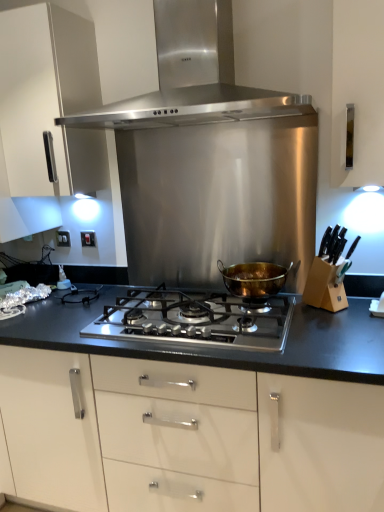
What is the approximate height of stainless steel range hood at upper center, marked as the 2th kitchen appliance in a bottom-to-top arrangement?

stainless steel range hood at upper center, marked as the 2th kitchen appliance in a bottom-to-top arrangement, is 22.13 inches tall.

The height and width of the screenshot is (512, 384). In order to click on white glossy cabinet at upper left in this screenshot , I will do `click(56, 135)`.

Describe the element at coordinates (253, 279) in the screenshot. I see `gold metallic pot at center, the second kitchen appliance positioned from the top` at that location.

I want to click on stainless steel gas stove at center, so click(x=195, y=319).

Which is behind, point (198, 118) or point (34, 65)?

The point (198, 118) is more distant.

From a real-world perspective, is stainless steel range hood at upper center, marked as the 2th kitchen appliance in a bottom-to-top arrangement, above or below white glossy cabinet at upper left?

Clearly, from a real-world perspective, stainless steel range hood at upper center, marked as the 2th kitchen appliance in a bottom-to-top arrangement, is above white glossy cabinet at upper left.

Consider the image. Is stainless steel range hood at upper center, marked as the 2th kitchen appliance in a bottom-to-top arrangement, oriented towards white glossy cabinet at upper left?

No, stainless steel range hood at upper center, marked as the 2th kitchen appliance in a bottom-to-top arrangement, is not turned towards white glossy cabinet at upper left.

Considering the relative sizes of stainless steel range hood at upper center, which is counted as the 1th kitchen appliance, starting from the top, and white glossy cabinet at upper left in the image provided, is stainless steel range hood at upper center, which is counted as the 1th kitchen appliance, starting from the top, wider than white glossy cabinet at upper left?

Correct, the width of stainless steel range hood at upper center, which is counted as the 1th kitchen appliance, starting from the top, exceeds that of white glossy cabinet at upper left.

The height and width of the screenshot is (512, 384). What are the coordinates of `the 2nd kitchen appliance to the right when counting from the white plastic electric outlet at left, the first electric outlet from the front` in the screenshot? It's located at (253, 279).

Considering the sizes of objects white plastic electric outlet at left, arranged as the second electric outlet when viewed from the left, and gold metallic pot at center, the first kitchen appliance when ordered from bottom to top, in the image provided, who is bigger, white plastic electric outlet at left, arranged as the second electric outlet when viewed from the left, or gold metallic pot at center, the first kitchen appliance when ordered from bottom to top,?

With larger size is gold metallic pot at center, the first kitchen appliance when ordered from bottom to top.

Could you measure the distance between white plastic electric outlet at left, arranged as the second electric outlet when viewed from the left, and gold metallic pot at center, the first kitchen appliance when ordered from bottom to top?

They are 33.06 inches apart.

Which is more to the left, white plastic electric outlet at left, arranged as the 2th electric outlet when viewed from the back, or gold metallic pot at center, the second kitchen appliance positioned from the top?

Positioned to the left is white plastic electric outlet at left, arranged as the 2th electric outlet when viewed from the back.

From the image's perspective, which one is positioned lower, white plastic electric outlet at left, arranged as the 2th electric outlet when viewed from the back, or white glossy cabinet at upper left?

white plastic electric outlet at left, arranged as the 2th electric outlet when viewed from the back, appears lower in the image.

Is the position of white plastic electric outlet at left, the first electric outlet viewed from the right, less distant than that of white glossy cabinet at upper left?

No, the depth of white plastic electric outlet at left, the first electric outlet viewed from the right, is greater than that of white glossy cabinet at upper left.

Is white plastic electric outlet at left, arranged as the 2th electric outlet when viewed from the back, oriented towards white glossy cabinet at upper left?

No.

In the scene shown: From a real-world perspective, who is located lower, stainless steel gas stove at center or stainless steel range hood at upper center, marked as the 2th kitchen appliance in a bottom-to-top arrangement?

In real-world perspective, stainless steel gas stove at center is lower.

Does point (278, 348) lie behind point (161, 31)?

That is False.

Is stainless steel gas stove at center facing away from stainless steel range hood at upper center, marked as the 2th kitchen appliance in a bottom-to-top arrangement?

No, stainless steel range hood at upper center, marked as the 2th kitchen appliance in a bottom-to-top arrangement, is not at the back of stainless steel gas stove at center.

Consider the image. How far apart are stainless steel gas stove at center and stainless steel range hood at upper center, marked as the 2th kitchen appliance in a bottom-to-top arrangement?

stainless steel gas stove at center is 31.25 inches from stainless steel range hood at upper center, marked as the 2th kitchen appliance in a bottom-to-top arrangement.

Visually, is stainless steel gas stove at center positioned to the left or to the right of white plastic electric outlet at left, arranged as the second electric outlet when viewed from the left?

Clearly, stainless steel gas stove at center is on the right of white plastic electric outlet at left, arranged as the second electric outlet when viewed from the left, in the image.

How different are the orientations of stainless steel gas stove at center and white plastic electric outlet at left, arranged as the second electric outlet when viewed from the left, in degrees?

0.234 degrees.

Considering the sizes of stainless steel gas stove at center and white plastic electric outlet at left, the first electric outlet from the front, in the image, is stainless steel gas stove at center taller or shorter than white plastic electric outlet at left, the first electric outlet from the front,?

Clearly, stainless steel gas stove at center is taller compared to white plastic electric outlet at left, the first electric outlet from the front.

From the image's perspective, which one is positioned higher, gold metallic pot at center, the second kitchen appliance positioned from the top, or white plastic electric outlet at left, which ranks as the 1th electric outlet in back-to-front order?

white plastic electric outlet at left, which ranks as the 1th electric outlet in back-to-front order, appears higher in the image.

Considering the positions of objects gold metallic pot at center, the second kitchen appliance positioned from the top, and white plastic electric outlet at left, which appears as the 1th electric outlet when viewed from the left, in the image provided, who is more to the right, gold metallic pot at center, the second kitchen appliance positioned from the top, or white plastic electric outlet at left, which appears as the 1th electric outlet when viewed from the left,?

Positioned to the right is gold metallic pot at center, the second kitchen appliance positioned from the top.

Is gold metallic pot at center, the second kitchen appliance positioned from the top, turned away from white plastic electric outlet at left, which appears as the second electric outlet when viewed from the front?

No, gold metallic pot at center, the second kitchen appliance positioned from the top,'s orientation is not away from white plastic electric outlet at left, which appears as the second electric outlet when viewed from the front.

Between gold metallic pot at center, the second kitchen appliance positioned from the top, and white plastic electric outlet at left, which ranks as the 1th electric outlet in back-to-front order, which one has more height?

Standing taller between the two is gold metallic pot at center, the second kitchen appliance positioned from the top.

Considering the points (63, 245) and (254, 323), which point is behind, point (63, 245) or point (254, 323)?

The point (63, 245) is behind.

From the image's perspective, is white plastic electric outlet at left, which appears as the 1th electric outlet when viewed from the left, over stainless steel gas stove at center?

Yes, from the image's perspective, white plastic electric outlet at left, which appears as the 1th electric outlet when viewed from the left, is above stainless steel gas stove at center.

What's the angular difference between white plastic electric outlet at left, which ranks as the 1th electric outlet in back-to-front order, and stainless steel gas stove at center's facing directions?

0.234 degrees.

Considering the relative positions of white plastic electric outlet at left, which appears as the 1th electric outlet when viewed from the left, and stainless steel gas stove at center in the image provided, is white plastic electric outlet at left, which appears as the 1th electric outlet when viewed from the left, to the right of stainless steel gas stove at center from the viewer's perspective?

No.

Starting from the white glossy cabinet at upper left, which kitchen appliance is the 1st one to the right? Please provide its 2D coordinates.

[(192, 77)]

Identify the location of the 1st electric outlet to the left of the gold metallic pot at center, the second kitchen appliance positioned from the top, starting your count from the anchor. Image resolution: width=384 pixels, height=512 pixels. (88, 239).

Looking at the image, which one is located further to stainless steel range hood at upper center, marked as the 2th kitchen appliance in a bottom-to-top arrangement, white glossy cabinet at upper left or gold metallic pot at center, the first kitchen appliance when ordered from bottom to top?

The object further to stainless steel range hood at upper center, marked as the 2th kitchen appliance in a bottom-to-top arrangement, is gold metallic pot at center, the first kitchen appliance when ordered from bottom to top.

Estimate the real-world distances between objects in this image. Which object is further from white glossy cabinet at upper left, stainless steel range hood at upper center, which is counted as the 1th kitchen appliance, starting from the top, or white plastic electric outlet at left, the first electric outlet viewed from the right?

Among the two, white plastic electric outlet at left, the first electric outlet viewed from the right, is located further to white glossy cabinet at upper left.

Which object lies further to the anchor point stainless steel range hood at upper center, marked as the 2th kitchen appliance in a bottom-to-top arrangement, white plastic electric outlet at left, arranged as the second electric outlet when viewed from the left, or white glossy cabinet at upper left?

white plastic electric outlet at left, arranged as the second electric outlet when viewed from the left, lies further to stainless steel range hood at upper center, marked as the 2th kitchen appliance in a bottom-to-top arrangement, than the other object.

Based on their spatial positions, is white plastic electric outlet at left, arranged as the second electric outlet when viewed from the left, or white plastic electric outlet at left, which is counted as the second electric outlet, starting from the right, closer to white glossy cabinet at upper left?

white plastic electric outlet at left, arranged as the second electric outlet when viewed from the left, is closer to white glossy cabinet at upper left.

Considering their positions, is white plastic electric outlet at left, which appears as the second electric outlet when viewed from the front, positioned further to white plastic electric outlet at left, the first electric outlet viewed from the right, than stainless steel range hood at upper center, which is counted as the 1th kitchen appliance, starting from the top?

The object further to white plastic electric outlet at left, the first electric outlet viewed from the right, is stainless steel range hood at upper center, which is counted as the 1th kitchen appliance, starting from the top.

Considering their positions, is white plastic electric outlet at left, which is counted as the second electric outlet, starting from the right, positioned closer to stainless steel range hood at upper center, marked as the 2th kitchen appliance in a bottom-to-top arrangement, than white glossy cabinet at upper left?

Based on the image, white glossy cabinet at upper left appears to be nearer to stainless steel range hood at upper center, marked as the 2th kitchen appliance in a bottom-to-top arrangement.

Based on their spatial positions, is white glossy cabinet at upper left or white plastic electric outlet at left, which ranks as the 1th electric outlet in back-to-front order, further from stainless steel gas stove at center?

Based on the image, white plastic electric outlet at left, which ranks as the 1th electric outlet in back-to-front order, appears to be further to stainless steel gas stove at center.

Estimate the real-world distances between objects in this image. Which object is further from white glossy cabinet at upper left, white plastic electric outlet at left, the first electric outlet viewed from the right, or gold metallic pot at center, the second kitchen appliance positioned from the top?

gold metallic pot at center, the second kitchen appliance positioned from the top.

Where is `electric outlet between stainless steel gas stove at center and white plastic electric outlet at left, which is counted as the second electric outlet, starting from the right, from front to back`? The width and height of the screenshot is (384, 512). electric outlet between stainless steel gas stove at center and white plastic electric outlet at left, which is counted as the second electric outlet, starting from the right, from front to back is located at coordinates (88, 239).

You are a GUI agent. You are given a task and a screenshot of the screen. Output one action in this format:
    pyautogui.click(x=<x>, y=<y>)
    Task: Click on the cabinetry between stainless steel range hood at upper center, which is counted as the 1th kitchen appliance, starting from the top, and stainless steel gas stove at center, in the vertical direction
    Image resolution: width=384 pixels, height=512 pixels.
    Given the screenshot: What is the action you would take?
    tap(56, 135)

You are a GUI agent. You are given a task and a screenshot of the screen. Output one action in this format:
    pyautogui.click(x=<x>, y=<y>)
    Task: Click on the electric outlet positioned between white glossy cabinet at upper left and white plastic electric outlet at left, which is counted as the second electric outlet, starting from the right, from near to far
    
    Given the screenshot: What is the action you would take?
    pyautogui.click(x=88, y=239)

What are the coordinates of `kitchen appliance located between stainless steel gas stove at center and white plastic electric outlet at left, the first electric outlet viewed from the right, in the depth direction` in the screenshot? It's located at (253, 279).